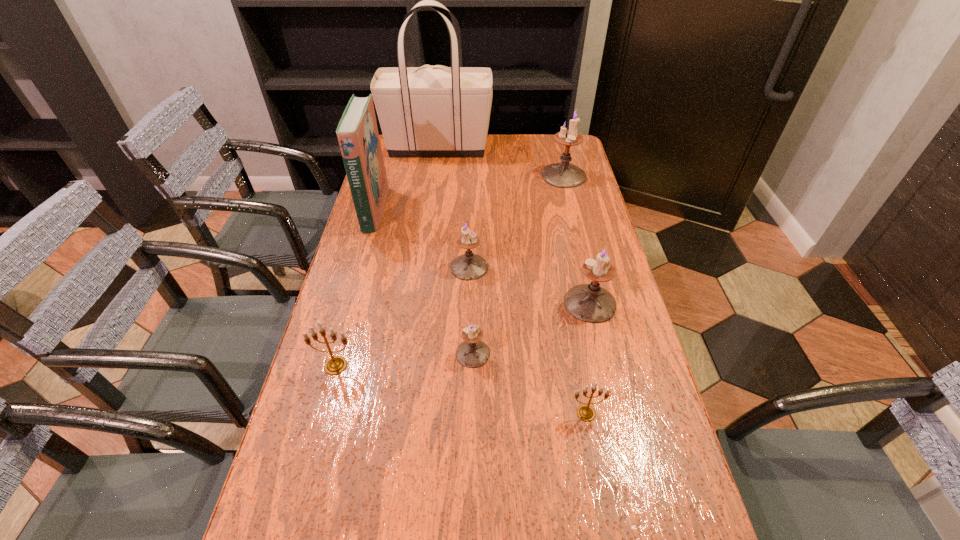
I want to click on the bigger gold candelabrum, so click(x=335, y=365).

Where is `the left gold candelabrum`? This screenshot has height=540, width=960. the left gold candelabrum is located at coordinates (335, 365).

Locate an element on the screen. This screenshot has width=960, height=540. the smallest purple candle holder is located at coordinates (472, 353).

Locate an element on the screen. The height and width of the screenshot is (540, 960). the nearest object is located at coordinates pyautogui.click(x=586, y=413).

What are the coordinates of `the nearer gold candelabrum` in the screenshot? It's located at (586, 413).

Locate an element on the screen. The height and width of the screenshot is (540, 960). free region located with handles facing forward on the farthest object is located at coordinates (563, 147).

At what (x,y) coordinates should I click in order to perform the action: click on vacant region located on the cover of the second tallest object. Please return your answer as a coordinate pair (x, y). Looking at the image, I should click on [x=444, y=210].

Image resolution: width=960 pixels, height=540 pixels. What are the coordinates of `free space located on the left of the seventh nearest object` in the screenshot? It's located at (473, 176).

Locate an element on the screen. free space located on the left of the fifth farthest object is located at coordinates (420, 303).

Where is `vacant space located on the back of the second smallest purple candle holder`? The height and width of the screenshot is (540, 960). vacant space located on the back of the second smallest purple candle holder is located at coordinates (470, 227).